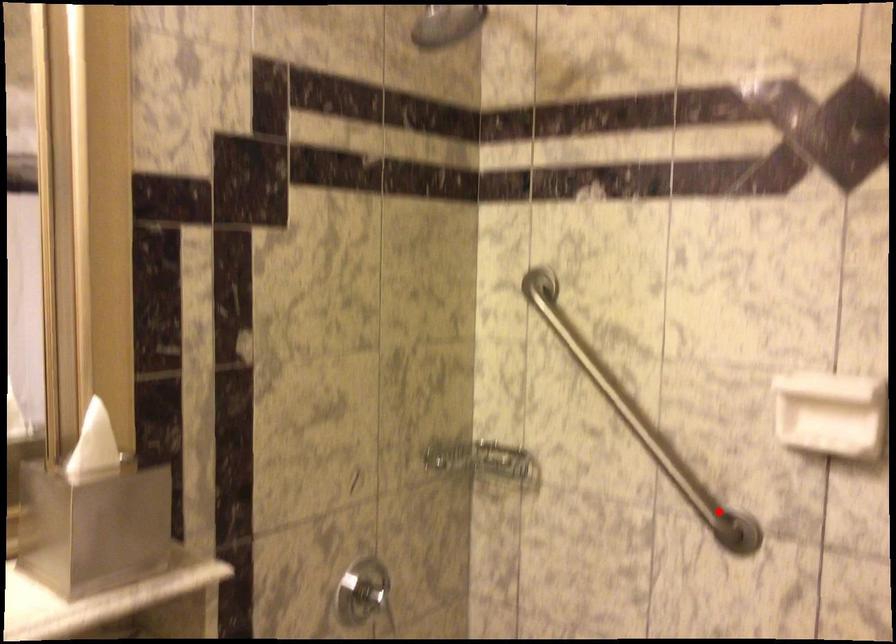
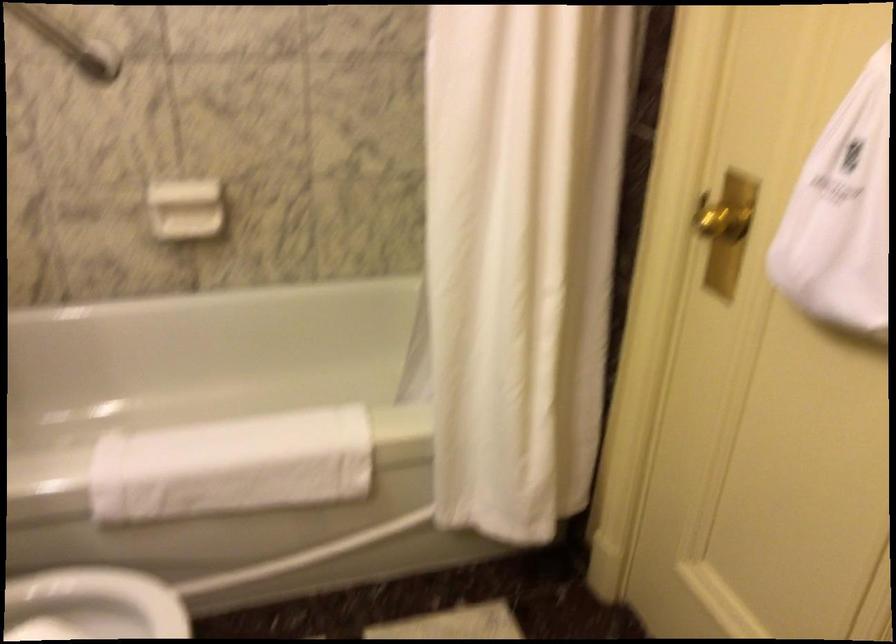
Locate, in the second image, the point that corresponds to the highlighted location in the first image.

(69, 42)